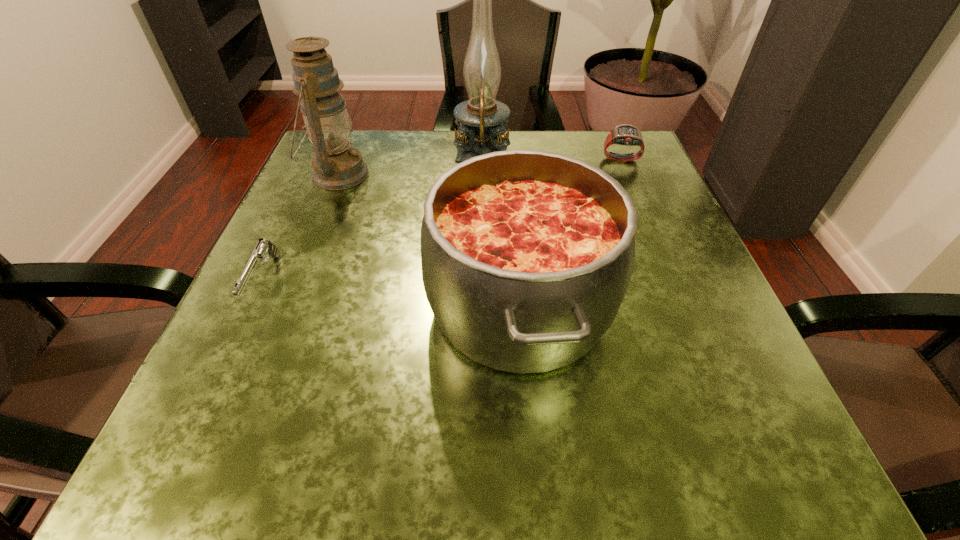
In the image, there is a desktop. At what (x,y) coordinates should I click in order to perform the action: click on free space at the near edge. Please return your answer as a coordinate pair (x, y). This screenshot has height=540, width=960. Looking at the image, I should click on (487, 488).

Identify the location of free space at the left edge of the desktop. (281, 297).

Locate an element on the screen. vacant area at the right edge is located at coordinates (647, 279).

The width and height of the screenshot is (960, 540). Find the location of `free spot at the far left corner of the desktop`. free spot at the far left corner of the desktop is located at coordinates (387, 139).

Locate an element on the screen. free spot at the far right corner of the desktop is located at coordinates (613, 149).

Find the location of a particular element. The image size is (960, 540). free spot at the near right corner of the desktop is located at coordinates (791, 474).

I want to click on free space between the taller oil lamp and the shortest object, so click(x=373, y=220).

Find the location of a particular element. Image resolution: width=960 pixels, height=540 pixels. vacant space in between the taller oil lamp and the pistol is located at coordinates (373, 220).

Find the location of a particular element. The height and width of the screenshot is (540, 960). vacant space in between the right oil lamp and the shortest object is located at coordinates (373, 220).

At what (x,y) coordinates should I click in order to perform the action: click on object that is the closest to the rightmost object. Please return your answer as a coordinate pair (x, y). Image resolution: width=960 pixels, height=540 pixels. Looking at the image, I should click on (481, 119).